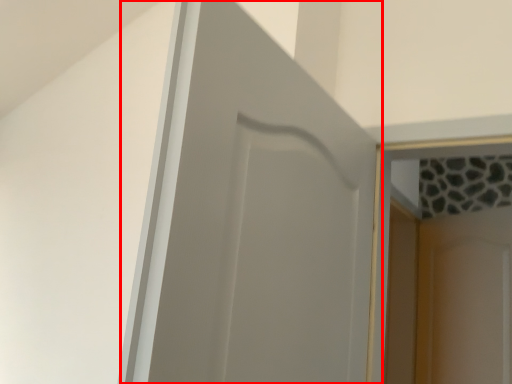
Question: From the image's perspective, considering the relative positions of door (annotated by the red box) and screen door in the image provided, where is door (annotated by the red box) located with respect to the staircase?

Choices:
 (A) below
 (B) above

Answer: (B)